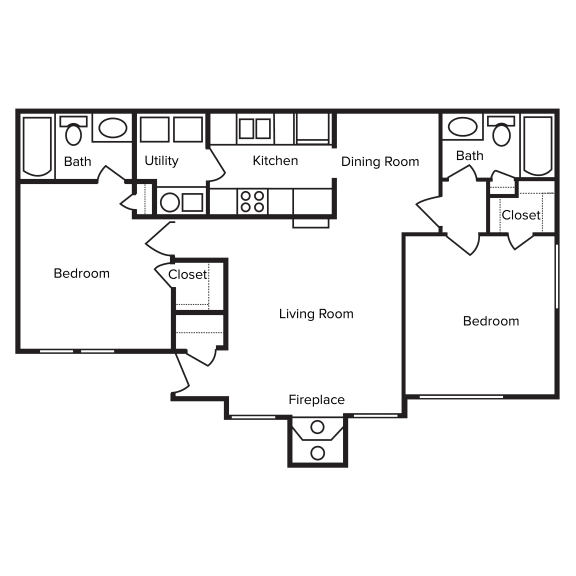
Locate an element on the screen. This screenshot has height=576, width=576. floorplan is located at coordinates [337, 253].